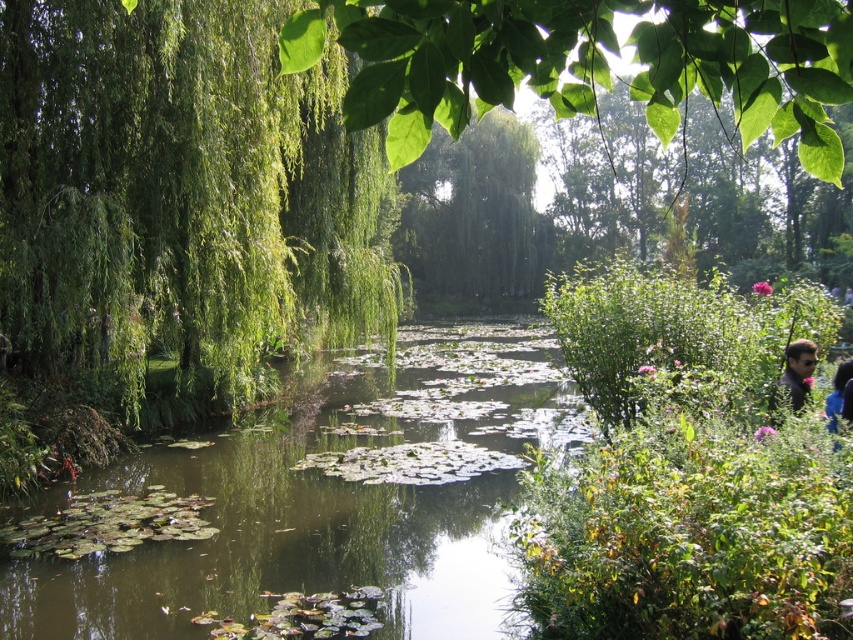
Question: Does green leafy willow at center have a lesser width compared to dark gray shirt at lower right?

Choices:
 (A) no
 (B) yes

Answer: (A)

Question: Which of the following is the closest to the observer?

Choices:
 (A) (540, 376)
 (B) (3, 193)

Answer: (B)

Question: Is green leafy willow at left further to camera compared to green leafy river at center?

Choices:
 (A) yes
 (B) no

Answer: (A)

Question: Which point appears closest to the camera in this image?

Choices:
 (A) (99, 596)
 (B) (793, 392)

Answer: (B)

Question: Is green leafy river at center positioned before dark gray shirt at lower right?

Choices:
 (A) yes
 (B) no

Answer: (A)

Question: Among these objects, which one is nearest to the camera?

Choices:
 (A) green leafy willow at center
 (B) dark gray shirt at lower right
 (C) green leafy river at center

Answer: (C)